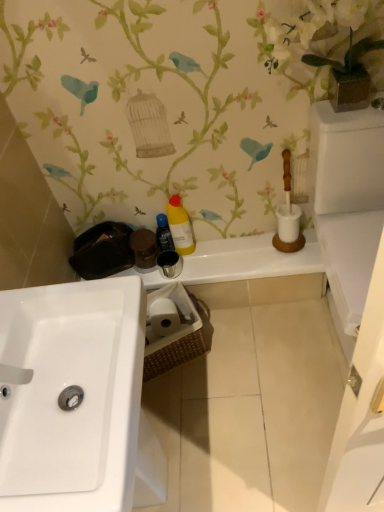
What do you see at coordinates (237, 262) in the screenshot? This screenshot has width=384, height=512. I see `matte black toiletries at center` at bounding box center [237, 262].

Image resolution: width=384 pixels, height=512 pixels. What do you see at coordinates (164, 234) in the screenshot?
I see `yellow matte bottle at center, arranged as the 1th cleaning product when viewed from the left` at bounding box center [164, 234].

Identify the location of yellow matte bottle at center, arranged as the 1th cleaning product when viewed from the left. (164, 234).

This screenshot has width=384, height=512. Find the location of `yellow matte bottle at center, which is the 2th cleaning product in left-to-right order`. yellow matte bottle at center, which is the 2th cleaning product in left-to-right order is located at coordinates (180, 226).

I want to click on white glossy sink at lower left, so click(x=65, y=387).

How far apart are yellow matte bottle at center, which is the 2th cleaning product in left-to-right order, and matte black toiletries at center?

yellow matte bottle at center, which is the 2th cleaning product in left-to-right order, and matte black toiletries at center are 8.34 inches apart from each other.

How different are the orientations of yellow matte bottle at center, which is the 2th cleaning product in left-to-right order, and matte black toiletries at center in degrees?

The angular difference between yellow matte bottle at center, which is the 2th cleaning product in left-to-right order, and matte black toiletries at center is 0.597 degrees.

Is yellow matte bottle at center, the 1th cleaning product when ordered from right to left, positioned with its back to matte black toiletries at center?

No, yellow matte bottle at center, the 1th cleaning product when ordered from right to left, is not facing away from matte black toiletries at center.

Which object is closer to the camera taking this photo, yellow matte bottle at center, the 1th cleaning product when ordered from right to left, or matte black toiletries at center?

yellow matte bottle at center, the 1th cleaning product when ordered from right to left, is more forward.

From the image's perspective, which one is positioned higher, matte black toiletries at center or yellow matte bottle at center, the 1th cleaning product when ordered from right to left?

From the image's view, yellow matte bottle at center, the 1th cleaning product when ordered from right to left, is above.

Is matte black toiletries at center bigger than yellow matte bottle at center, the 1th cleaning product when ordered from right to left?

Indeed, matte black toiletries at center has a larger size compared to yellow matte bottle at center, the 1th cleaning product when ordered from right to left.

Is matte black toiletries at center wider than yellow matte bottle at center, which is the 2th cleaning product in left-to-right order?

Correct, the width of matte black toiletries at center exceeds that of yellow matte bottle at center, which is the 2th cleaning product in left-to-right order.

Does matte black toiletries at center have a greater height compared to yellow matte bottle at center, which is the 2th cleaning product in left-to-right order?

Incorrect, the height of matte black toiletries at center is not larger of that of yellow matte bottle at center, which is the 2th cleaning product in left-to-right order.

Are yellow matte bottle at center, the second cleaning product positioned from the right, and yellow matte bottle at center, which is the 2th cleaning product in left-to-right order, located far from each other?

No, yellow matte bottle at center, the second cleaning product positioned from the right, is not far away from yellow matte bottle at center, which is the 2th cleaning product in left-to-right order.

Based on their sizes in the image, would you say yellow matte bottle at center, arranged as the 1th cleaning product when viewed from the left, is bigger or smaller than yellow matte bottle at center, which is the 2th cleaning product in left-to-right order?

Considering their sizes, yellow matte bottle at center, arranged as the 1th cleaning product when viewed from the left, takes up less space than yellow matte bottle at center, which is the 2th cleaning product in left-to-right order.

In the scene shown: Is yellow matte bottle at center, arranged as the 1th cleaning product when viewed from the left, inside or outside of yellow matte bottle at center, which is the 2th cleaning product in left-to-right order?

yellow matte bottle at center, arranged as the 1th cleaning product when viewed from the left, lies outside yellow matte bottle at center, which is the 2th cleaning product in left-to-right order.

From the image's perspective, is yellow matte bottle at center, which is the 2th cleaning product in left-to-right order, located above or below white glossy sink at lower left?

Clearly, from the image's perspective, yellow matte bottle at center, which is the 2th cleaning product in left-to-right order, is above white glossy sink at lower left.

Looking at this image, are yellow matte bottle at center, the 1th cleaning product when ordered from right to left, and white glossy sink at lower left located far from each other?

No, yellow matte bottle at center, the 1th cleaning product when ordered from right to left, is not far away from white glossy sink at lower left.

Based on the photo, which of these two, yellow matte bottle at center, the 1th cleaning product when ordered from right to left, or white glossy sink at lower left, stands taller?

white glossy sink at lower left is taller.

Is yellow matte bottle at center, the 1th cleaning product when ordered from right to left, positioned in front of white glossy sink at lower left?

No, yellow matte bottle at center, the 1th cleaning product when ordered from right to left, is behind white glossy sink at lower left.

From the image's perspective, is yellow matte bottle at center, the 1th cleaning product when ordered from right to left, above or below yellow matte bottle at center, arranged as the 1th cleaning product when viewed from the left?

yellow matte bottle at center, the 1th cleaning product when ordered from right to left, is situated higher than yellow matte bottle at center, arranged as the 1th cleaning product when viewed from the left, in the image.

In the scene shown: Considering the relative sizes of yellow matte bottle at center, the 1th cleaning product when ordered from right to left, and yellow matte bottle at center, arranged as the 1th cleaning product when viewed from the left, in the image provided, is yellow matte bottle at center, the 1th cleaning product when ordered from right to left, thinner than yellow matte bottle at center, arranged as the 1th cleaning product when viewed from the left,?

No, yellow matte bottle at center, the 1th cleaning product when ordered from right to left, is not thinner than yellow matte bottle at center, arranged as the 1th cleaning product when viewed from the left.

How many degrees apart are the facing directions of yellow matte bottle at center, which is the 2th cleaning product in left-to-right order, and yellow matte bottle at center, the second cleaning product positioned from the right?

They differ by 0.000691 degrees in their facing directions.

From the picture: Visually, is yellow matte bottle at center, which is the 2th cleaning product in left-to-right order, positioned to the left or to the right of yellow matte bottle at center, the second cleaning product positioned from the right?

From the image, it's evident that yellow matte bottle at center, which is the 2th cleaning product in left-to-right order, is to the right of yellow matte bottle at center, the second cleaning product positioned from the right.

Which object is further away from the camera, matte black toiletries at center or white glossy sink at lower left?

matte black toiletries at center is further from the camera.

Which is correct: matte black toiletries at center is inside white glossy sink at lower left, or outside of it?

matte black toiletries at center is spatially situated outside white glossy sink at lower left.

Is matte black toiletries at center in contact with white glossy sink at lower left?

No, matte black toiletries at center is not making contact with white glossy sink at lower left.

What's the angular difference between matte black toiletries at center and white glossy sink at lower left's facing directions?

89 degrees.

Considering the positions of objects white matte vase at upper right and yellow matte bottle at center, arranged as the 1th cleaning product when viewed from the left, in the image provided, who is more to the left, white matte vase at upper right or yellow matte bottle at center, arranged as the 1th cleaning product when viewed from the left,?

yellow matte bottle at center, arranged as the 1th cleaning product when viewed from the left, is more to the left.

Is white matte vase at upper right wider or thinner than yellow matte bottle at center, the second cleaning product positioned from the right?

In the image, white matte vase at upper right appears to be wider than yellow matte bottle at center, the second cleaning product positioned from the right.

From a real-world perspective, which is physically above, white matte vase at upper right or yellow matte bottle at center, the second cleaning product positioned from the right?

white matte vase at upper right is physically above.

There is a white matte vase at upper right. At what (x,y) coordinates should I click in order to perform the action: click on the 2nd cleaning product below it (from the image's perspective). Please return your answer as a coordinate pair (x, y). This screenshot has height=512, width=384. Looking at the image, I should click on (164, 234).

Identify the location of counter top that is on the right side of yellow matte bottle at center, the 1th cleaning product when ordered from right to left. (237, 262).

This screenshot has height=512, width=384. Find the location of `counter top below the yellow matte bottle at center, which is the 2th cleaning product in left-to-right order (from a real-world perspective)`. counter top below the yellow matte bottle at center, which is the 2th cleaning product in left-to-right order (from a real-world perspective) is located at coordinates (237, 262).

Looking at the image, which one is located closer to yellow matte bottle at center, the second cleaning product positioned from the right, white glossy sink at lower left or yellow matte bottle at center, the 1th cleaning product when ordered from right to left?

yellow matte bottle at center, the 1th cleaning product when ordered from right to left.

When comparing their distances from yellow matte bottle at center, which is the 2th cleaning product in left-to-right order, does white matte vase at upper right or white glossy sink at lower left seem closer?

The object closer to yellow matte bottle at center, which is the 2th cleaning product in left-to-right order, is white matte vase at upper right.

From the image, which object appears to be farther from yellow matte bottle at center, the second cleaning product positioned from the right, white matte vase at upper right or yellow matte bottle at center, the 1th cleaning product when ordered from right to left?

Among the two, white matte vase at upper right is located further to yellow matte bottle at center, the second cleaning product positioned from the right.

From the image, which object appears to be nearer to yellow matte bottle at center, arranged as the 1th cleaning product when viewed from the left, yellow matte bottle at center, which is the 2th cleaning product in left-to-right order, or white matte vase at upper right?

Based on the image, yellow matte bottle at center, which is the 2th cleaning product in left-to-right order, appears to be nearer to yellow matte bottle at center, arranged as the 1th cleaning product when viewed from the left.

In the scene shown: From the image, which object appears to be farther from white glossy sink at lower left, yellow matte bottle at center, arranged as the 1th cleaning product when viewed from the left, or matte black toiletries at center?

yellow matte bottle at center, arranged as the 1th cleaning product when viewed from the left, is further to white glossy sink at lower left.

From the image, which object appears to be nearer to matte black toiletries at center, white matte vase at upper right or white glossy sink at lower left?

The object closer to matte black toiletries at center is white matte vase at upper right.

Looking at the image, which one is located closer to yellow matte bottle at center, the second cleaning product positioned from the right, white matte vase at upper right or matte black toiletries at center?

matte black toiletries at center lies closer to yellow matte bottle at center, the second cleaning product positioned from the right, than the other object.

From the image, which object appears to be farther from white glossy sink at lower left, yellow matte bottle at center, arranged as the 1th cleaning product when viewed from the left, or white matte vase at upper right?

Among the two, white matte vase at upper right is located further to white glossy sink at lower left.

The height and width of the screenshot is (512, 384). I want to click on cleaning product positioned between white matte vase at upper right and matte black toiletries at center from near to far, so click(x=180, y=226).

This screenshot has height=512, width=384. Find the location of `cleaning product between white glossy sink at lower left and matte black toiletries at center in the front-back direction`. cleaning product between white glossy sink at lower left and matte black toiletries at center in the front-back direction is located at coordinates pyautogui.click(x=180, y=226).

Find the location of a particular element. The width and height of the screenshot is (384, 512). cleaning product between yellow matte bottle at center, the 1th cleaning product when ordered from right to left, and matte black toiletries at center vertically is located at coordinates (164, 234).

Locate an element on the screen. The width and height of the screenshot is (384, 512). counter top that lies between white matte vase at upper right and white glossy sink at lower left from top to bottom is located at coordinates (237, 262).